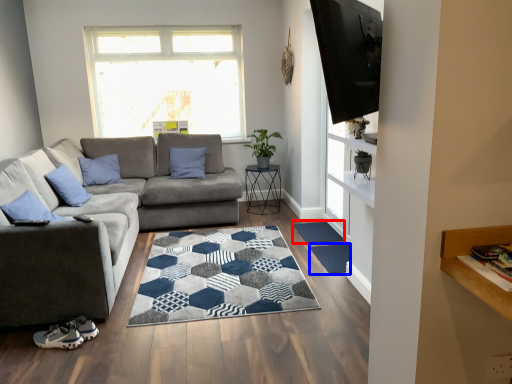
Question: Among these objects, which one is nearest to the camera, doormat (highlighted by a red box) or doormat (highlighted by a blue box)?

Choices:
 (A) doormat
 (B) doormat

Answer: (B)